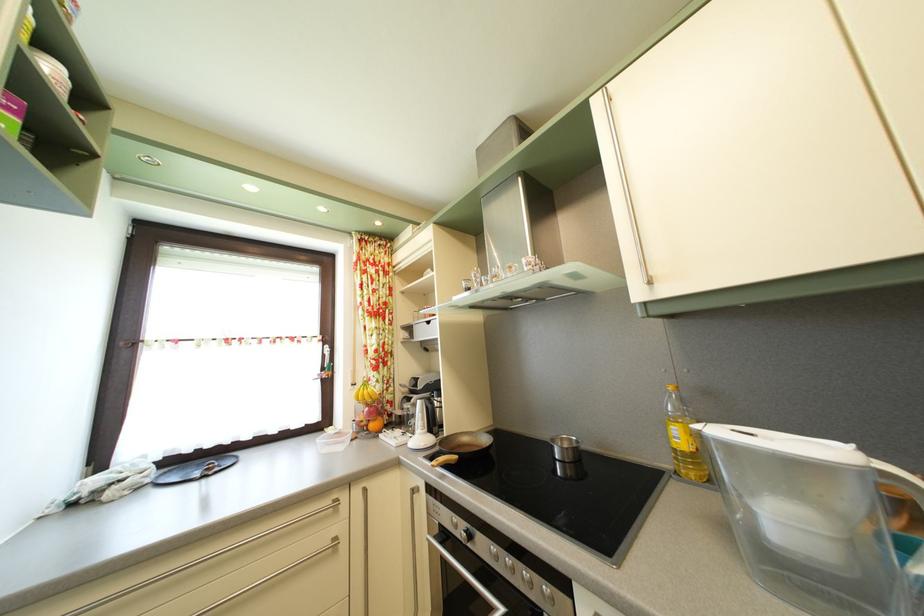
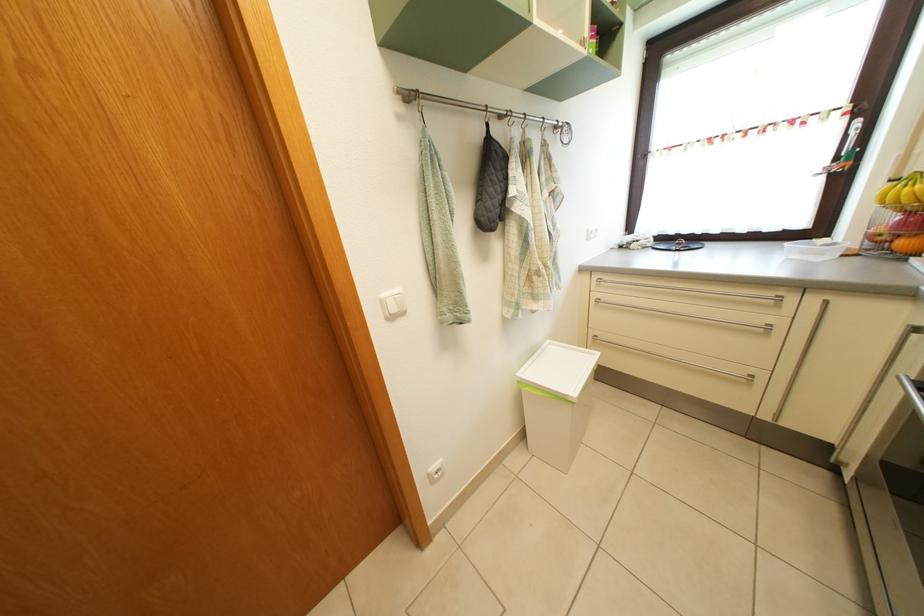
In the second image, find the point that corresponds to (381,432) in the first image.

(910, 252)